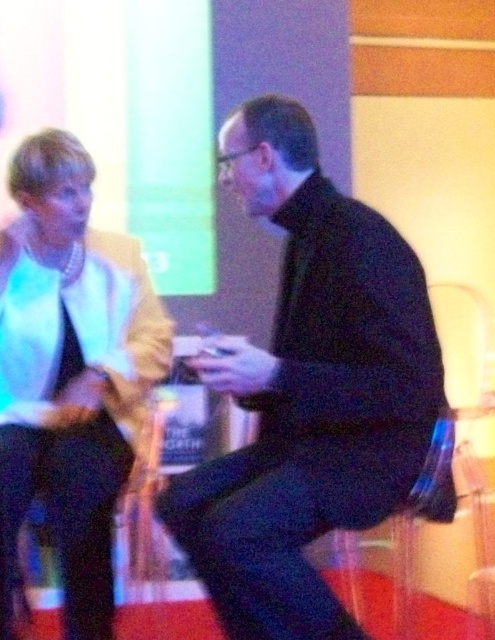
Question: Can you confirm if black matte jacket at center is positioned below matte white jacket at left?

Choices:
 (A) yes
 (B) no

Answer: (B)

Question: Is black matte jacket at center wider than matte white jacket at left?

Choices:
 (A) yes
 (B) no

Answer: (A)

Question: Considering the relative positions of black matte jacket at center and matte white jacket at left in the image provided, where is black matte jacket at center located with respect to matte white jacket at left?

Choices:
 (A) below
 (B) above

Answer: (B)

Question: Which point is farther to the camera?

Choices:
 (A) (327, 477)
 (B) (76, 237)

Answer: (B)

Question: Which object appears closest to the camera in this image?

Choices:
 (A) black matte jacket at center
 (B) matte white jacket at left

Answer: (A)